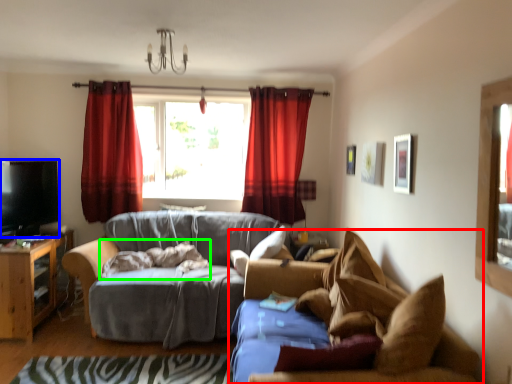
Question: Based on their relative distances, which object is nearer to studio couch (highlighted by a red box)? Choose from television (highlighted by a blue box) and blanket (highlighted by a green box).

Choices:
 (A) television
 (B) blanket

Answer: (B)